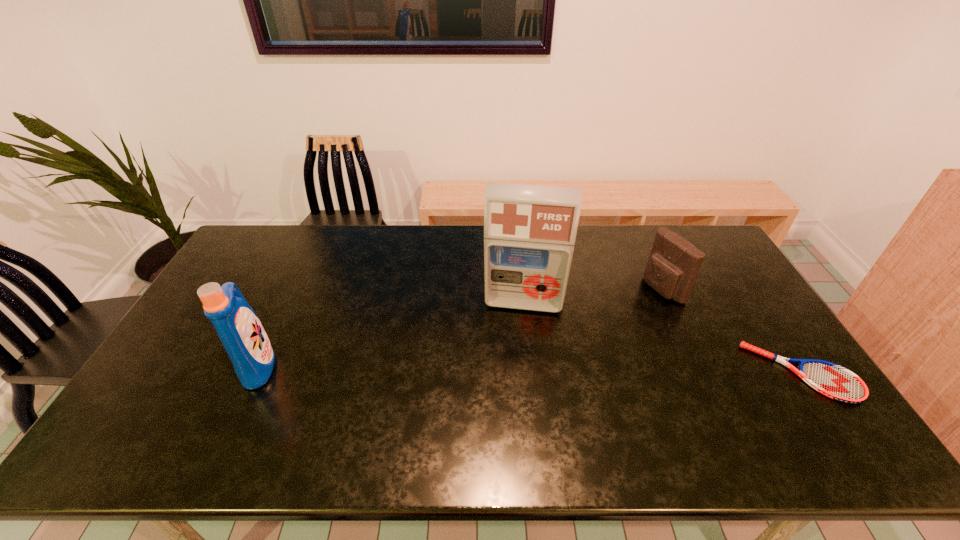
The height and width of the screenshot is (540, 960). Find the location of `free space at the far edge of the desktop`. free space at the far edge of the desktop is located at coordinates (330, 234).

The height and width of the screenshot is (540, 960). I want to click on vacant region at the near edge of the desktop, so click(425, 399).

The height and width of the screenshot is (540, 960). In the image, there is a desktop. In order to click on free space at the left edge in this screenshot , I will do `click(264, 265)`.

This screenshot has width=960, height=540. In the image, there is a desktop. Find the location of `vacant space at the right edge`. vacant space at the right edge is located at coordinates (732, 284).

You are a GUI agent. You are given a task and a screenshot of the screen. Output one action in this format:
    pyautogui.click(x=<x>, y=<y>)
    Task: Click on the vacant space at the far left corner of the desktop
    
    Given the screenshot: What is the action you would take?
    pyautogui.click(x=244, y=242)

Identify the location of vacant space in between the leftmost object and the first-aid kit. (391, 334).

Image resolution: width=960 pixels, height=540 pixels. I want to click on vacant space that's between the second object from right to left and the shortest object, so click(732, 331).

Identify the location of vacant space that's between the third object from left to right and the first-aid kit. (593, 296).

Locate an element on the screen. Image resolution: width=960 pixels, height=540 pixels. unoccupied area between the third object from left to right and the shortest object is located at coordinates (732, 331).

This screenshot has width=960, height=540. I want to click on vacant space that's between the pouch and the first-aid kit, so click(x=593, y=296).